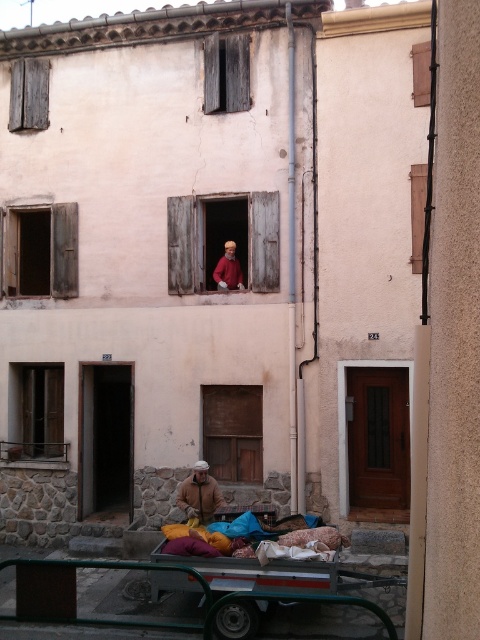
You are a delivery person who needs to unload a package from the wooden at center and place it onto the wooden at right. Can you do this without moving either wooden structure?

The wooden at center is located below the wooden at right, so you can directly place the package from the wooden at center onto the wooden at right since it is positioned above.

You are a delivery person who needs to deliver a package to the person in the upper window. You have a ladder that can be placed either next to the wooden at center or the wooden at right. Which location would allow you to reach the window safely?

The wooden at right is behind the wooden at center, so placing the ladder next to the wooden at center would provide better access to the window since it is closer to the building. The wooden at right being behind might block the ladder placement near the wall.